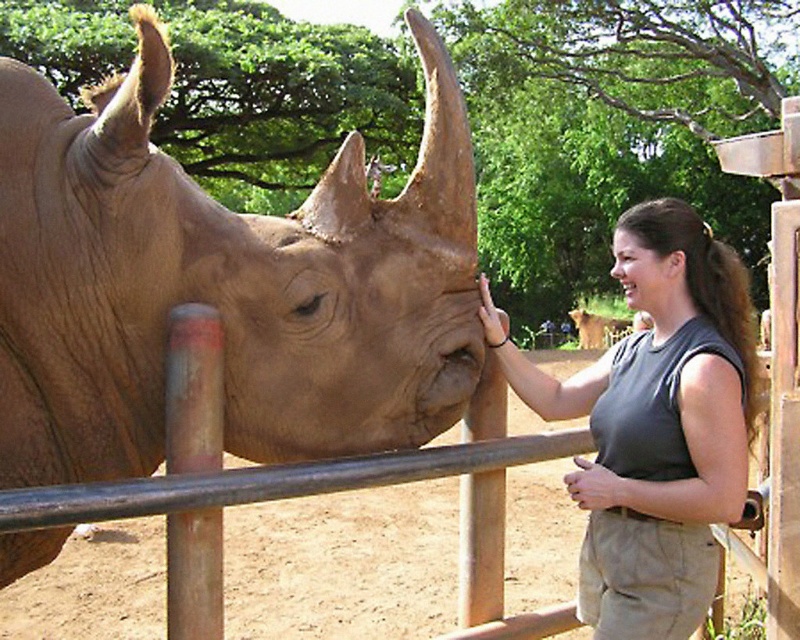
Can you confirm if gray fabric shirt at center is wider than metal fence at center?

No, gray fabric shirt at center is not wider than metal fence at center.

Does gray fabric shirt at center have a smaller size compared to metal fence at center?

Indeed, gray fabric shirt at center has a smaller size compared to metal fence at center.

Describe the element at coordinates (656, 424) in the screenshot. I see `gray fabric shirt at center` at that location.

Identify the location of gray fabric shirt at center. This screenshot has width=800, height=640. [x=656, y=424].

Between smooth tan rhino at center and brown fur lion at center, which one is positioned lower?

Positioned lower is brown fur lion at center.

Where is `smooth tan rhino at center`? This screenshot has height=640, width=800. smooth tan rhino at center is located at coordinates [224, 284].

Identify the location of smooth tan rhino at center. (224, 284).

Image resolution: width=800 pixels, height=640 pixels. I want to click on smooth tan rhino at center, so click(224, 284).

Locate an element on the screen. smooth tan rhino at center is located at coordinates (224, 284).